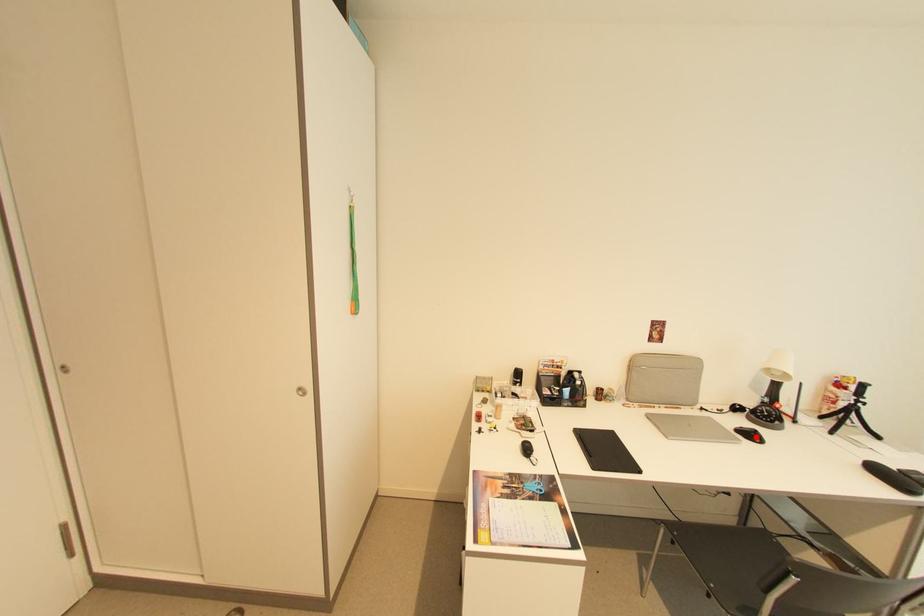
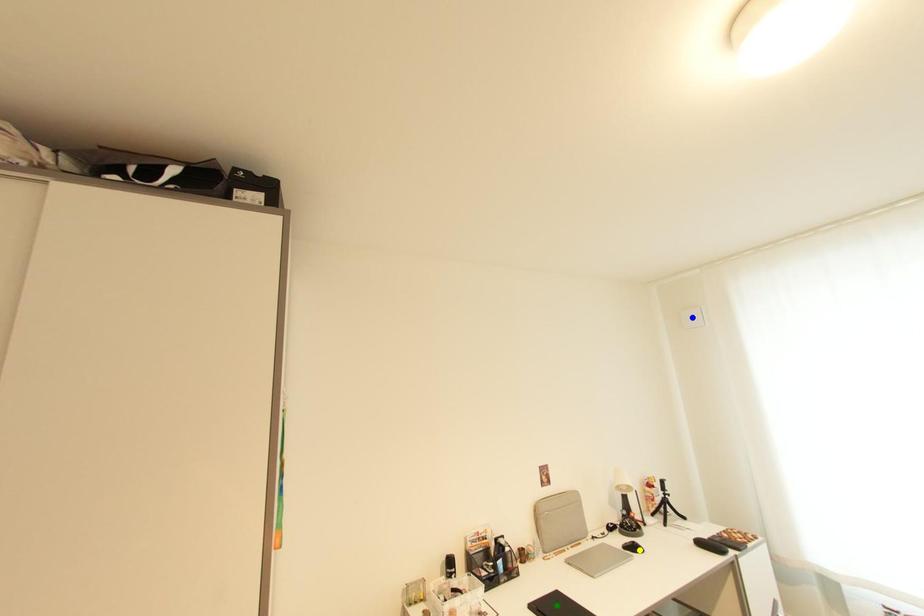
Question: I am providing you with two images of the same scene from different viewpoints. A red point is marked on the first image. You are given multiple points on the second image. Which spot in image 2 lines up with the point in image 1?

Choices:
 (A) blue point
 (B) yellow point
 (C) green point

Answer: (B)